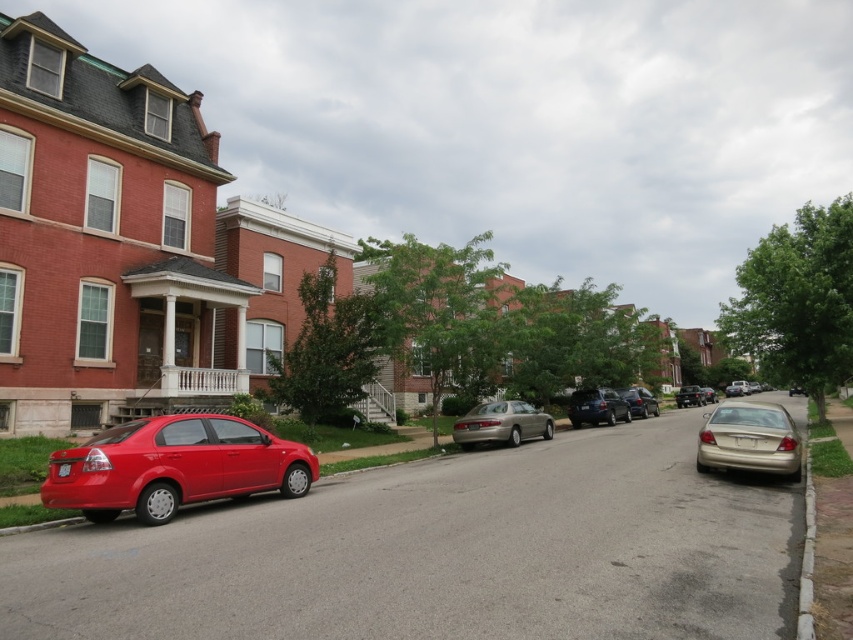
Image resolution: width=853 pixels, height=640 pixels. What do you see at coordinates (749, 440) in the screenshot? I see `gold metallic sedan at right` at bounding box center [749, 440].

Between gold metallic sedan at right and matte black sedan at center, which one appears on the right side from the viewer's perspective?

From the viewer's perspective, matte black sedan at center appears more on the right side.

Measure the distance between point (695, 458) and camera.

They are 13.93 meters apart.

You are a GUI agent. You are given a task and a screenshot of the screen. Output one action in this format:
    pyautogui.click(x=<x>, y=<y>)
    Task: Click on the gold metallic sedan at right
    Image resolution: width=853 pixels, height=640 pixels.
    Given the screenshot: What is the action you would take?
    pyautogui.click(x=749, y=440)

Is white concrete curb at lower right to the right of satin black suv at center from the viewer's perspective?

In fact, white concrete curb at lower right is to the left of satin black suv at center.

Can you confirm if white concrete curb at lower right is shorter than satin black suv at center?

Yes.

Where is `white concrete curb at lower right`? white concrete curb at lower right is located at coordinates (805, 554).

Who is lower down, gold metallic sedan at center or white concrete curb at lower right?

white concrete curb at lower right is lower down.

Is point (498, 412) closer to camera compared to point (804, 596)?

No, it is behind (804, 596).

Find the location of a particular element. This screenshot has width=853, height=640. gold metallic sedan at center is located at coordinates (502, 422).